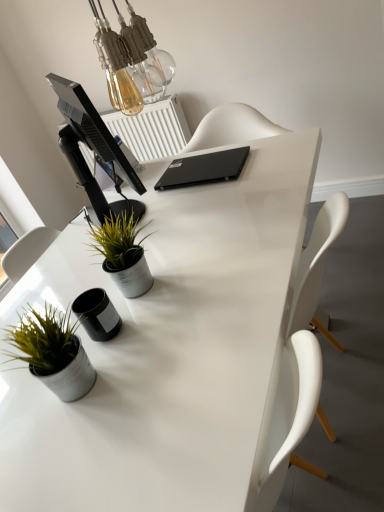
Question: From a real-world perspective, is white plastic radiator at upper center physically located above or below white glossy desk at center?

Choices:
 (A) below
 (B) above

Answer: (B)

Question: Would you say white plastic radiator at upper center is inside or outside white glossy desk at center?

Choices:
 (A) outside
 (B) inside

Answer: (A)

Question: Which object is the closest to the metallic gray pot at center, which is counted as the second houseplant, starting from the bottom?

Choices:
 (A) black matte laptop at center
 (B) black glossy monitor at upper left
 (C) matte gray pot at lower left, marked as the 2th houseplant in a back-to-front arrangement
 (D) white plastic radiator at upper center
 (E) white glossy desk at center

Answer: (B)

Question: Which is farther from the white plastic radiator at upper center?

Choices:
 (A) metallic gray pot at center, which is counted as the second houseplant, starting from the bottom
 (B) white glossy desk at center
 (C) matte gray pot at lower left, which is the 2th houseplant from top to bottom
 (D) black glossy monitor at upper left
 (E) black matte laptop at center

Answer: (C)